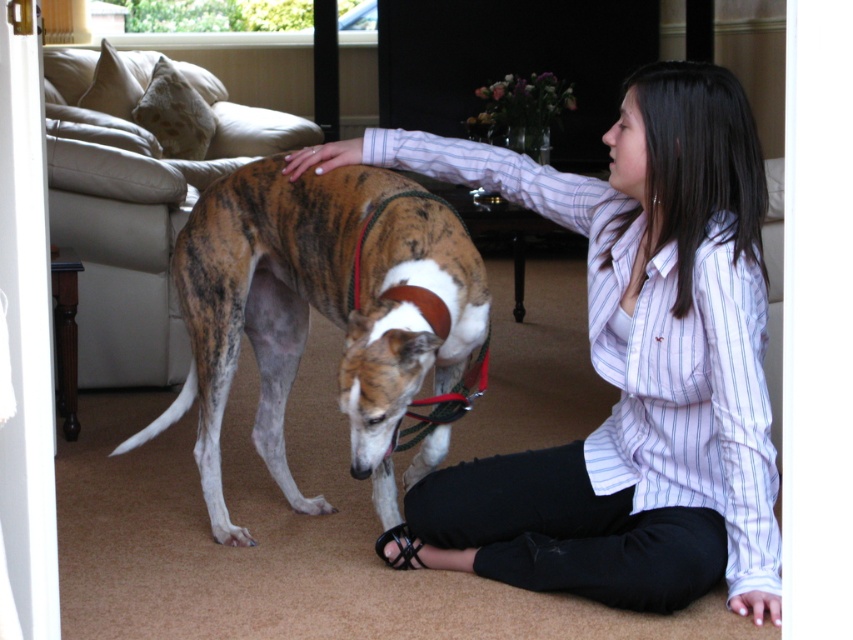
Question: Does matte striped shirt at center have a lesser width compared to brindle fur dog at center?

Choices:
 (A) yes
 (B) no

Answer: (B)

Question: Is matte striped shirt at center wider than brindle fur dog at center?

Choices:
 (A) yes
 (B) no

Answer: (A)

Question: Among these objects, which one is farthest from the camera?

Choices:
 (A) brindle fur dog at center
 (B) matte striped shirt at center

Answer: (A)

Question: Which object is closer to the camera taking this photo?

Choices:
 (A) matte striped shirt at center
 (B) brindle fur dog at center

Answer: (A)

Question: Does matte striped shirt at center have a lesser width compared to brindle fur dog at center?

Choices:
 (A) yes
 (B) no

Answer: (B)